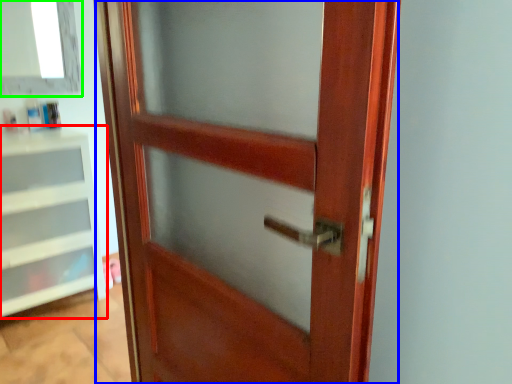
Question: Estimate the real-world distances between objects in this image. Which object is farther from shelf (highlighted by a red box), door (highlighted by a blue box) or window (highlighted by a green box)?

Choices:
 (A) door
 (B) window

Answer: (A)